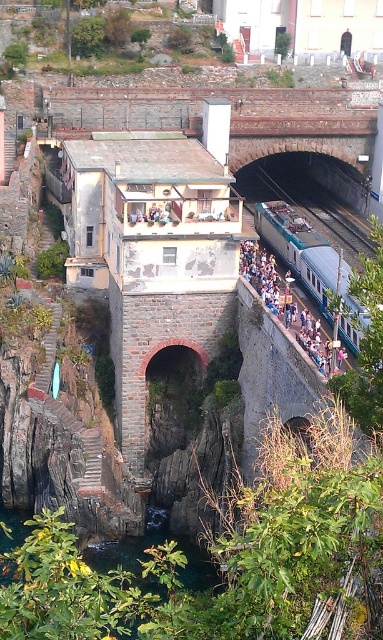
Question: Which point is closer to the camera?

Choices:
 (A) smooth concrete train track at center
 (B) blue fabric crowd at center

Answer: (B)

Question: Which is farther from the smooth concrete train track at center?

Choices:
 (A) teal glossy train at center
 (B) blue fabric crowd at center

Answer: (B)

Question: Does teal glossy train at center appear on the left side of smooth concrete train track at center?

Choices:
 (A) yes
 (B) no

Answer: (A)

Question: Does teal glossy train at center have a greater width compared to blue fabric crowd at center?

Choices:
 (A) yes
 (B) no

Answer: (B)

Question: Does smooth concrete train track at center have a smaller size compared to blue fabric crowd at center?

Choices:
 (A) no
 (B) yes

Answer: (A)

Question: Which is nearer to the smooth concrete train track at center?

Choices:
 (A) blue fabric crowd at center
 (B) teal glossy train at center

Answer: (B)